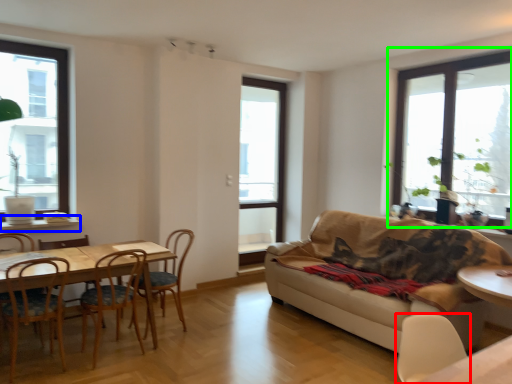
Question: Which object is the closest to the chair (highlighted by a red box)? Choose among these: window sill (highlighted by a blue box) or window (highlighted by a green box).

Choices:
 (A) window sill
 (B) window

Answer: (B)